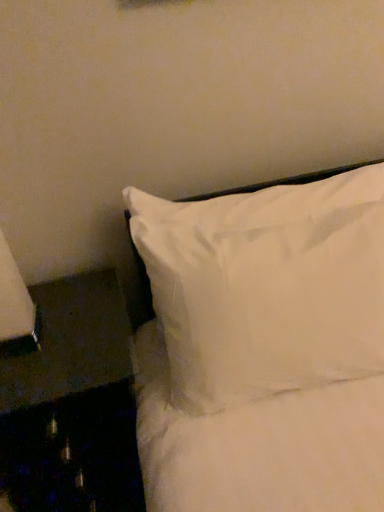
The image size is (384, 512). What do you see at coordinates (72, 404) in the screenshot? I see `black fabric side table at lower left` at bounding box center [72, 404].

What is the approximate height of black fabric side table at lower left?

It is 26.45 inches.

Where is `black fabric side table at lower left`? This screenshot has width=384, height=512. black fabric side table at lower left is located at coordinates (72, 404).

The image size is (384, 512). What do you see at coordinates (267, 287) in the screenshot?
I see `white soft pillow at upper right` at bounding box center [267, 287].

What is the approximate height of white soft pillow at upper right?

It is 21.10 inches.

Where is `white soft pillow at upper right`? This screenshot has width=384, height=512. white soft pillow at upper right is located at coordinates (267, 287).

Where is `black fabric side table at lower left`? The height and width of the screenshot is (512, 384). black fabric side table at lower left is located at coordinates (72, 404).

Which object is positioned more to the left, white soft pillow at upper right or black fabric side table at lower left?

black fabric side table at lower left.

Considering the relative positions of white soft pillow at upper right and black fabric side table at lower left in the image provided, is white soft pillow at upper right in front of black fabric side table at lower left?

Yes, it is in front of black fabric side table at lower left.

Which is nearer, (235, 366) or (9, 499)?

The point (235, 366) is closer to the camera.

Looking at this image, from the image's perspective, is white soft pillow at upper right located above black fabric side table at lower left?

Yes, from the image's perspective, white soft pillow at upper right is above black fabric side table at lower left.

From a real-world perspective, which is physically above, white soft pillow at upper right or black fabric side table at lower left?

white soft pillow at upper right, from a real-world perspective.

Which object is thinner, white soft pillow at upper right or black fabric side table at lower left?

Thinner between the two is white soft pillow at upper right.

Who is taller, white soft pillow at upper right or black fabric side table at lower left?

With more height is black fabric side table at lower left.

Does white soft pillow at upper right have a smaller size compared to black fabric side table at lower left?

No.

Do you think white soft pillow at upper right is within black fabric side table at lower left, or outside of it?

white soft pillow at upper right is not inside black fabric side table at lower left, it's outside.

Would you consider white soft pillow at upper right to be distant from black fabric side table at lower left?

white soft pillow at upper right is actually quite close to black fabric side table at lower left.

Is white soft pillow at upper right facing away from black fabric side table at lower left?

No, white soft pillow at upper right is not facing the opposite direction of black fabric side table at lower left.

How different are the orientations of white soft pillow at upper right and black fabric side table at lower left in degrees?

There is a 0.277-degree angle between the facing directions of white soft pillow at upper right and black fabric side table at lower left.

The width and height of the screenshot is (384, 512). I want to click on pillow above the black fabric side table at lower left (from the image's perspective), so click(267, 287).

Is black fabric side table at lower left to the left or to the right of white soft pillow at upper right in the image?

Clearly, black fabric side table at lower left is on the left of white soft pillow at upper right in the image.

Looking at this image, does black fabric side table at lower left lie in front of white soft pillow at upper right?

No, the depth of black fabric side table at lower left is greater than that of white soft pillow at upper right.

Is point (54, 301) positioned in front of point (361, 312)?

No, it is behind (361, 312).

From the image's perspective, who appears lower, black fabric side table at lower left or white soft pillow at upper right?

black fabric side table at lower left.

From a real-world perspective, does black fabric side table at lower left sit lower than white soft pillow at upper right?

Yes, from a real-world perspective, black fabric side table at lower left is beneath white soft pillow at upper right.

In terms of width, does black fabric side table at lower left look wider or thinner when compared to white soft pillow at upper right?

black fabric side table at lower left is wider than white soft pillow at upper right.

Considering the sizes of black fabric side table at lower left and white soft pillow at upper right in the image, is black fabric side table at lower left taller or shorter than white soft pillow at upper right?

Clearly, black fabric side table at lower left is taller compared to white soft pillow at upper right.

Considering the sizes of objects black fabric side table at lower left and white soft pillow at upper right in the image provided, who is smaller, black fabric side table at lower left or white soft pillow at upper right?

black fabric side table at lower left.

Choose the correct answer: Is black fabric side table at lower left inside white soft pillow at upper right or outside it?

black fabric side table at lower left is outside white soft pillow at upper right.

Is black fabric side table at lower left in contact with white soft pillow at upper right?

There is a gap between black fabric side table at lower left and white soft pillow at upper right.

Is black fabric side table at lower left oriented away from white soft pillow at upper right?

No, black fabric side table at lower left is not facing the opposite direction of white soft pillow at upper right.

Can you tell me how much black fabric side table at lower left and white soft pillow at upper right differ in facing direction?

They differ by 0.277 degrees in their facing directions.

This screenshot has width=384, height=512. I want to click on furniture directly beneath the white soft pillow at upper right (from a real-world perspective), so (x=72, y=404).

The width and height of the screenshot is (384, 512). Identify the location of furniture that is on the left side of white soft pillow at upper right. (72, 404).

The width and height of the screenshot is (384, 512). In order to click on furniture below the white soft pillow at upper right (from the image's perspective) in this screenshot , I will do `click(72, 404)`.